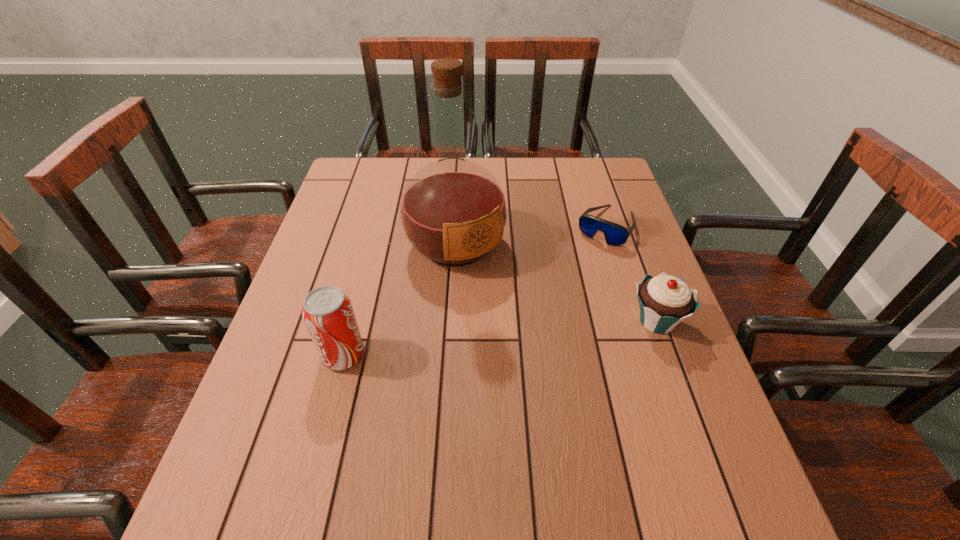
Image resolution: width=960 pixels, height=540 pixels. I want to click on vacant space at the right edge of the desktop, so click(x=675, y=396).

Where is `vacant space at the far left corner of the desktop`? This screenshot has height=540, width=960. vacant space at the far left corner of the desktop is located at coordinates (349, 178).

Identify the location of free spot at the near left corner of the desktop. This screenshot has width=960, height=540. (255, 427).

Locate an element on the screen. The image size is (960, 540). vacant space that's between the second object from left to right and the soda can is located at coordinates (399, 300).

This screenshot has height=540, width=960. Find the location of `free spot between the sunglasses and the soda can`. free spot between the sunglasses and the soda can is located at coordinates (475, 291).

Identify the location of vacant space that's between the sunglasses and the second tallest object. (475, 291).

The width and height of the screenshot is (960, 540). I want to click on free space between the shortest object and the tallest object, so click(x=531, y=235).

This screenshot has height=540, width=960. What are the coordinates of `free space between the leftmost object and the sunglasses` in the screenshot? It's located at (475, 291).

Locate an element on the screen. Image resolution: width=960 pixels, height=540 pixels. vacant area that lies between the cupcake and the liquor is located at coordinates (556, 282).

This screenshot has height=540, width=960. Find the location of `empty space between the second tallest object and the second object from left to right`. empty space between the second tallest object and the second object from left to right is located at coordinates (399, 300).